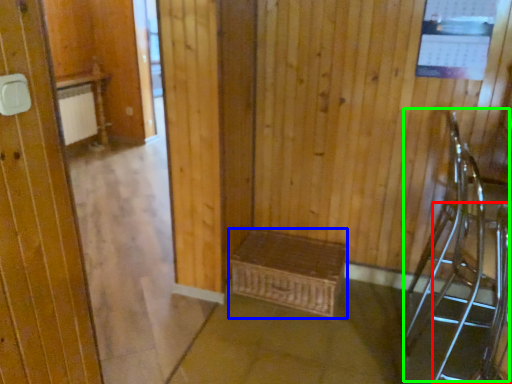
Question: Which is farther away from armchair (highlighted by a red box)? furniture (highlighted by a blue box) or armchair (highlighted by a green box)?

Choices:
 (A) furniture
 (B) armchair

Answer: (A)